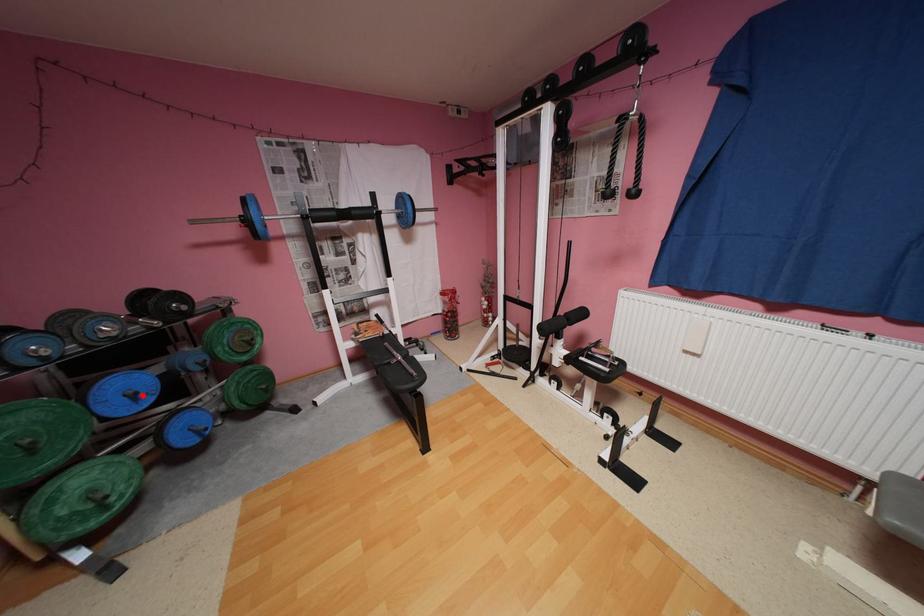
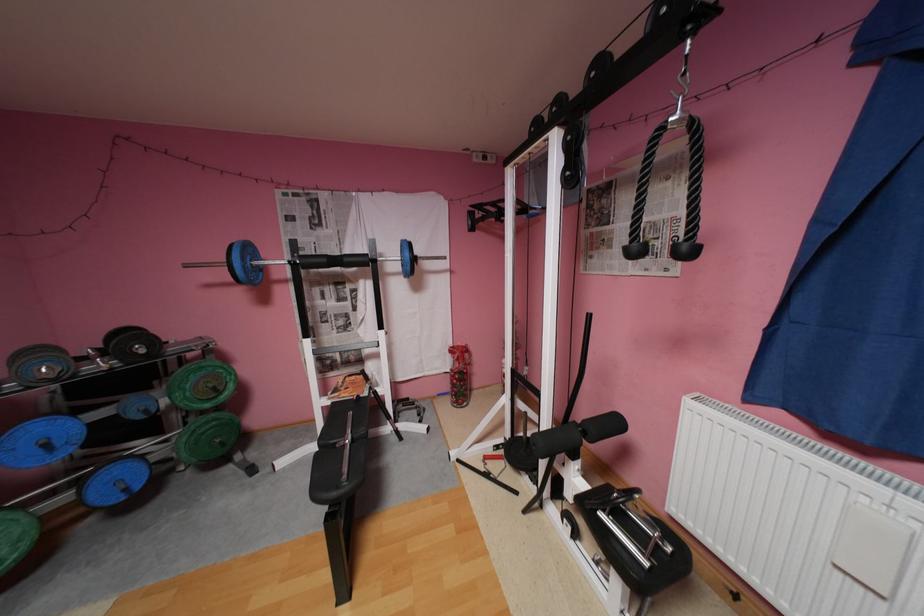
The point at the highlighted location is marked in the first image. Where is the corresponding point in the second image?

(55, 445)